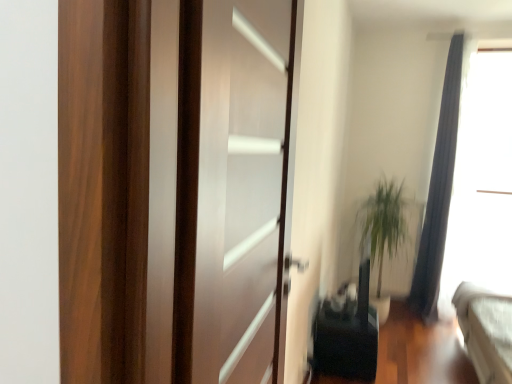
Locate an element on the screen. vacant area that lies in front of silky gray curtain at right is located at coordinates (428, 321).